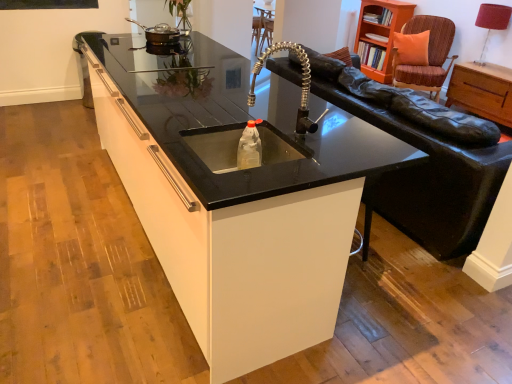
Question: From the image's perspective, is brown woven swivel chair at upper right on translucent plastic bottle at center?

Choices:
 (A) yes
 (B) no

Answer: (A)

Question: Is brown woven swivel chair at upper right positioned before translucent plastic bottle at center?

Choices:
 (A) yes
 (B) no

Answer: (B)

Question: Is brown woven swivel chair at upper right wider than translucent plastic bottle at center?

Choices:
 (A) yes
 (B) no

Answer: (A)

Question: From a real-world perspective, is brown woven swivel chair at upper right located higher than translucent plastic bottle at center?

Choices:
 (A) yes
 (B) no

Answer: (B)

Question: Can you confirm if brown woven swivel chair at upper right is positioned to the left of translucent plastic bottle at center?

Choices:
 (A) no
 (B) yes

Answer: (A)

Question: Is point (426, 69) positioned closer to the camera than point (161, 36)?

Choices:
 (A) closer
 (B) farther

Answer: (B)

Question: Looking at their shapes, would you say brown woven swivel chair at upper right is wider or thinner than metallic silver pan at upper left?

Choices:
 (A) thin
 (B) wide

Answer: (B)

Question: Visually, is brown woven swivel chair at upper right positioned to the left or to the right of metallic silver pan at upper left?

Choices:
 (A) right
 (B) left

Answer: (A)

Question: Is brown woven swivel chair at upper right situated inside metallic silver pan at upper left or outside?

Choices:
 (A) outside
 (B) inside

Answer: (A)

Question: Considering the positions of point (242, 337) and point (372, 19), is point (242, 337) closer or farther from the camera than point (372, 19)?

Choices:
 (A) closer
 (B) farther

Answer: (A)

Question: Considering the positions of black granite sink at center and orange wood bookshelf at upper right in the image, is black granite sink at center taller or shorter than orange wood bookshelf at upper right?

Choices:
 (A) short
 (B) tall

Answer: (B)

Question: From a real-world perspective, relative to orange wood bookshelf at upper right, is black granite sink at center vertically above or below?

Choices:
 (A) above
 (B) below

Answer: (B)

Question: In the image, is black granite sink at center positioned in front of or behind orange wood bookshelf at upper right?

Choices:
 (A) behind
 (B) front

Answer: (B)

Question: From their relative heights in the image, would you say red fabric lampshade at upper right is taller or shorter than black granite sink at center?

Choices:
 (A) tall
 (B) short

Answer: (B)

Question: Considering the relative positions of red fabric lampshade at upper right and black granite sink at center in the image provided, is red fabric lampshade at upper right to the left or to the right of black granite sink at center?

Choices:
 (A) left
 (B) right

Answer: (B)